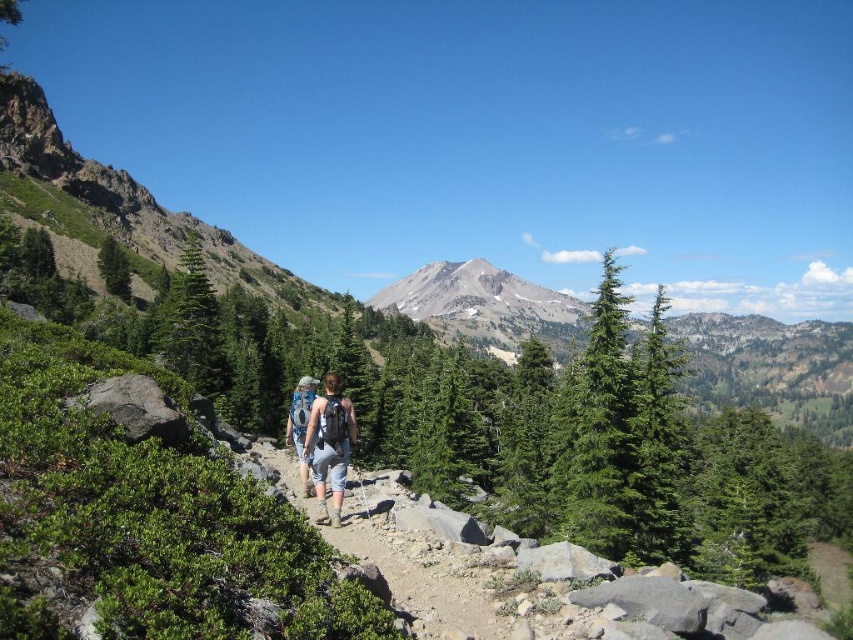
Which is more to the right, green textured evergreen tree at center or green matte evergreen tree at center-right?

green matte evergreen tree at center-right is more to the right.

Measure the distance between green textured evergreen tree at center and camera.

A distance of 57.71 meters exists between green textured evergreen tree at center and camera.

Is point (608, 472) positioned after point (688, 547)?

No, (608, 472) is closer to viewer.

Locate an element on the screen. This screenshot has height=640, width=853. green textured evergreen tree at center is located at coordinates (602, 432).

Is point (585, 525) farther from camera compared to point (308, 410)?

That is True.

Between green textured evergreen tree at center and blue backpack at center, which one is positioned higher?

green textured evergreen tree at center is above.

Is point (627, 547) positioned after point (305, 387)?

Yes, point (627, 547) is farther from viewer.

Where is `green textured evergreen tree at center`? green textured evergreen tree at center is located at coordinates (602, 432).

Is point (315, 460) positioned in front of point (300, 442)?

Yes, point (315, 460) is closer to viewer.

Does denim shorts at center have a larger size compared to blue backpack at center?

Actually, denim shorts at center might be smaller than blue backpack at center.

Locate an element on the screen. denim shorts at center is located at coordinates [x=329, y=445].